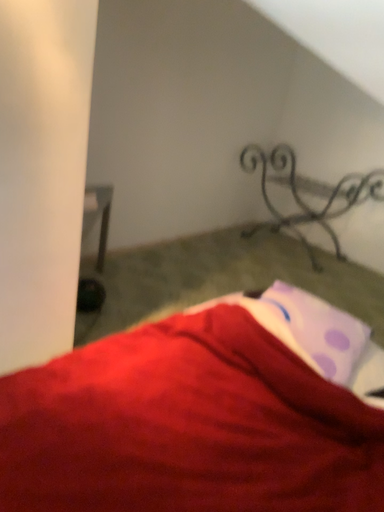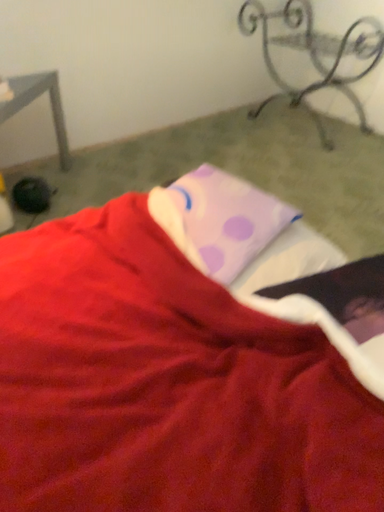
Question: How did the camera likely rotate when shooting the video?

Choices:
 (A) rotated upward
 (B) rotated downward

Answer: (B)